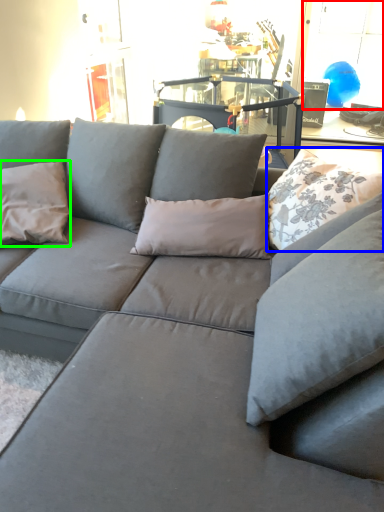
Question: Estimate the real-world distances between objects in this image. Which object is farther from window (highlighted by a red box), pillow (highlighted by a blue box) or pillow (highlighted by a green box)?

Choices:
 (A) pillow
 (B) pillow

Answer: (B)